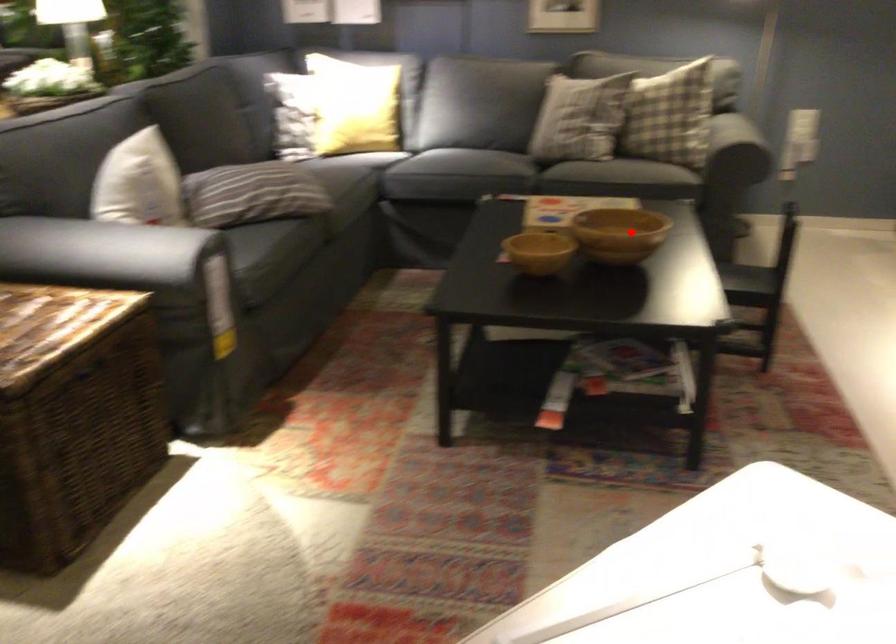
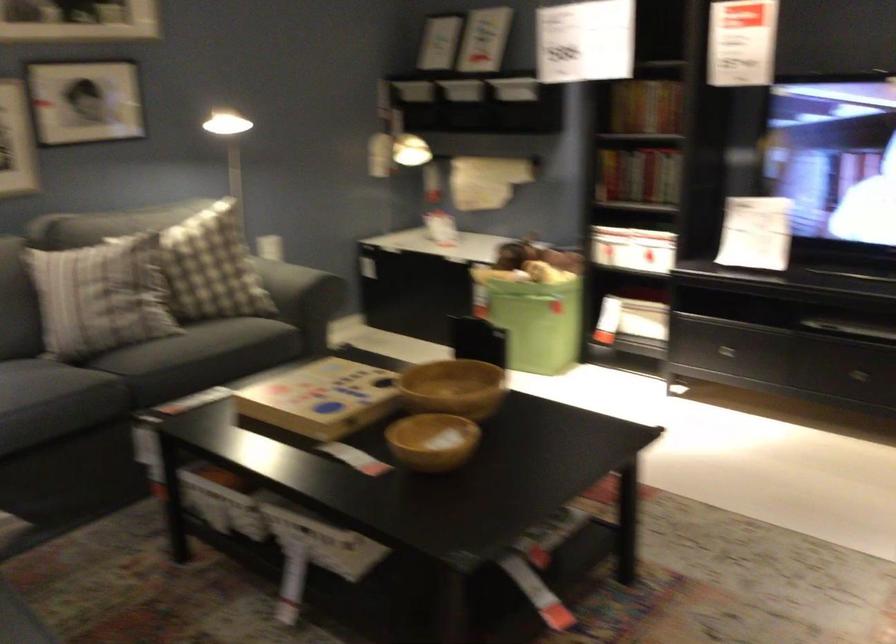
Question: I am providing you with two images of the same scene from different viewpoints. In image1, a red point is highlighted. Considering the same 3D point in image2, which of the following is correct?

Choices:
 (A) It is closer
 (B) It is farther

Answer: (A)